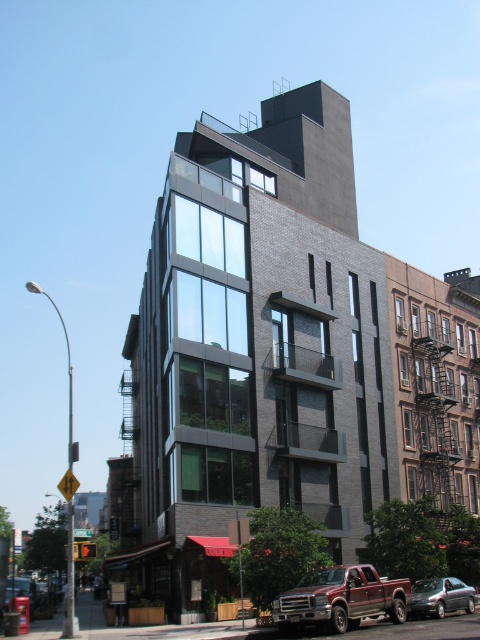
Question: Which point appears farthest from the camera in this image?

Choices:
 (A) (324, 586)
 (B) (431, 584)

Answer: (B)

Question: Is matte red truck at lower right positioned in front of metallic silver sedan at center?

Choices:
 (A) no
 (B) yes

Answer: (B)

Question: Which of the following is the closest to the observer?

Choices:
 (A) (296, 605)
 (B) (450, 586)

Answer: (A)

Question: Which of the following is the farthest from the observer?

Choices:
 (A) matte red truck at lower right
 (B) metallic silver sedan at center

Answer: (B)

Question: Where is matte red truck at lower right located in relation to metallic silver sedan at center in the image?

Choices:
 (A) below
 (B) above

Answer: (B)

Question: Does matte red truck at lower right appear on the right side of metallic silver sedan at center?

Choices:
 (A) yes
 (B) no

Answer: (B)